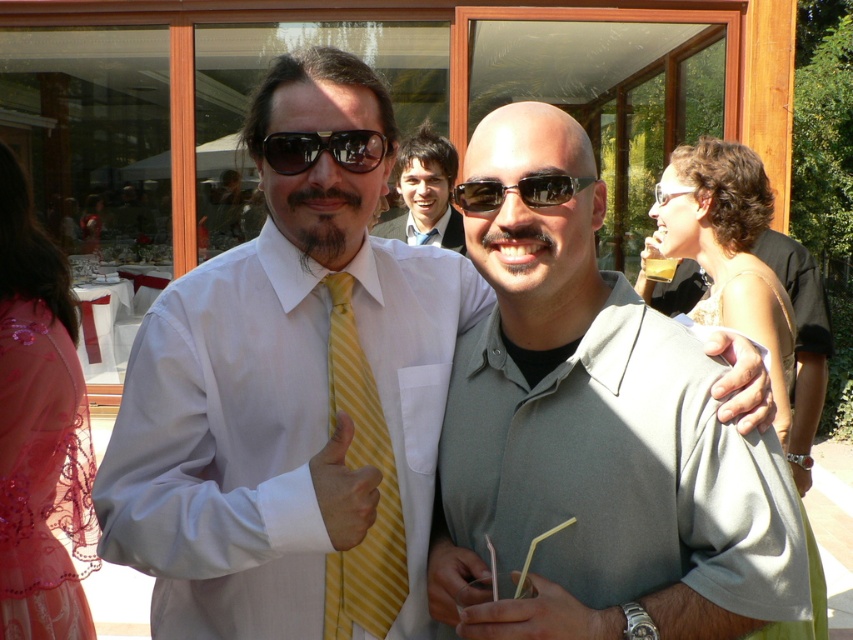
Question: Is black reflective sunglasses at center to the right of black matte sunglasses at center from the viewer's perspective?

Choices:
 (A) yes
 (B) no

Answer: (B)

Question: From the image, what is the correct spatial relationship of smooth skin hand at center in relation to gray fabric hand at center?

Choices:
 (A) below
 (B) above

Answer: (A)

Question: In this image, where is yellow striped tie at center located relative to smooth beige hand at center?

Choices:
 (A) right
 (B) left

Answer: (B)

Question: Among these objects, which one is farthest from the camera?

Choices:
 (A) smooth skin hand at center
 (B) matte gray polo shirt at center
 (C) light brown hair at center
 (D) black reflective sunglasses at center

Answer: (C)

Question: Which object appears farthest from the camera in this image?

Choices:
 (A) smooth beige hand at center
 (B) white matte tie at center

Answer: (A)

Question: Which object is the closest to the black reflective sunglasses at center?

Choices:
 (A) white matte tie at center
 (B) pink sequined dress at left
 (C) gray fabric hand at center
 (D) white satin dress shirt at left

Answer: (D)